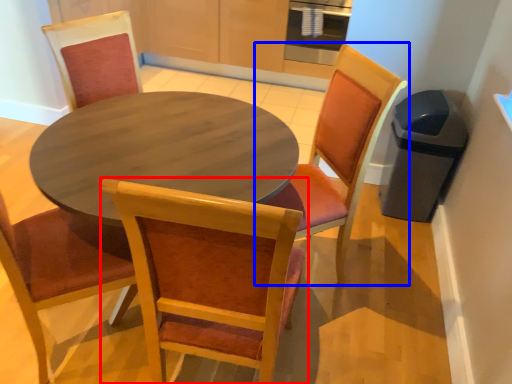
Question: Which of the following is the farthest to the observer, chair (highlighted by a red box) or chair (highlighted by a blue box)?

Choices:
 (A) chair
 (B) chair

Answer: (B)